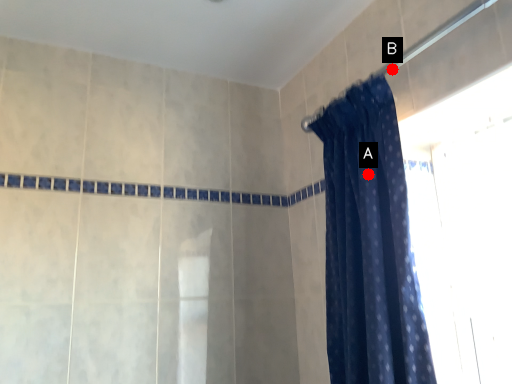
Question: Two points are circled on the image, labeled by A and B beside each circle. Which point is farther from the camera taking this photo?

Choices:
 (A) A is further
 (B) B is further

Answer: (B)